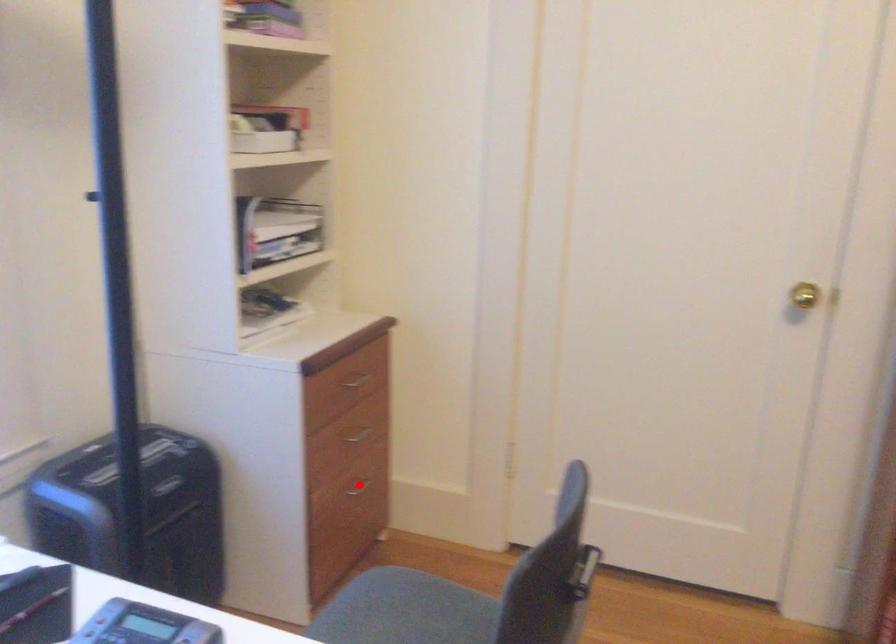
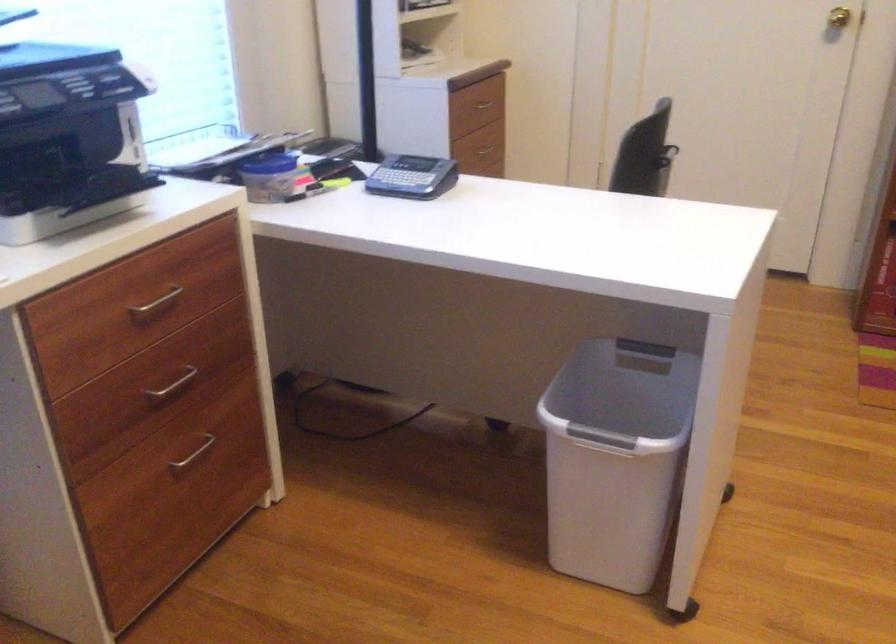
Question: I am providing you with two images of the same scene from different viewpoints. A red point is marked on the first image. At the location where the point appears in image 1, is it still visible in image 2?

Choices:
 (A) Yes
 (B) No

Answer: (B)